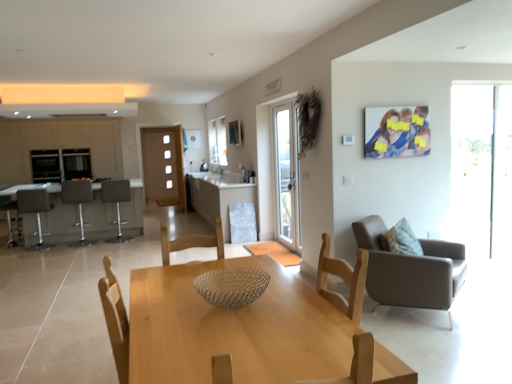
Question: From a real-world perspective, is light wood table at center positioned above or below white marble table at center, which is the first table in right-to-left order?

Choices:
 (A) below
 (B) above

Answer: (A)

Question: From their relative heights in the image, would you say light wood table at center is taller or shorter than white marble table at center, which ranks as the 2th table in left-to-right order?

Choices:
 (A) tall
 (B) short

Answer: (B)

Question: Estimate the real-world distances between objects in this image. Which object is farther from the light wood table at center?

Choices:
 (A) textured beige pillow at right
 (B) matte gray bar stool at left, the second chair in the front-to-back sequence
 (C) matte gray table at left, marked as the 1th table in a left-to-right arrangement
 (D) matte gray armchair at right, which is the fourth chair from left to right
 (E) transparent glass door at right

Answer: (B)

Question: Which object is the closest to the matte gray table at left, marked as the 1th table in a left-to-right arrangement?

Choices:
 (A) transparent glass door at right
 (B) gray fabric bar stool at left, marked as the 1th chair in a back-to-front arrangement
 (C) white glossy exhaust hood at upper center
 (D) textured beige pillow at right
 (E) white marble table at center, which is the first table in right-to-left order

Answer: (B)